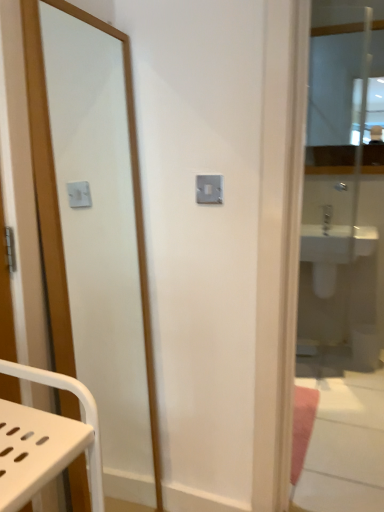
Locate an element on the screen. clear glass mirror at right, which ranks as the 2th mirror in front-to-back order is located at coordinates (343, 262).

At what (x,y) coordinates should I click in order to perform the action: click on matte wooden mirror at left, acting as the first mirror starting from the left. Please return your answer as a coordinate pair (x, y). This screenshot has height=512, width=384. Looking at the image, I should click on (104, 230).

How much space does matte wooden mirror at left, acting as the first mirror starting from the left, occupy vertically?

matte wooden mirror at left, acting as the first mirror starting from the left, is 1.64 meters in height.

You are a GUI agent. You are given a task and a screenshot of the screen. Output one action in this format:
    pyautogui.click(x=<x>, y=<y>)
    Task: Click on the white glossy sink at right
    
    Given the screenshot: What is the action you would take?
    pyautogui.click(x=336, y=243)

Which object is closer to the camera taking this photo, clear glass mirror at right, placed as the 2th mirror when sorted from back to front, or matte wooden mirror at left, which is the third mirror in back-to-front order?

matte wooden mirror at left, which is the third mirror in back-to-front order, is in front.

Between clear glass mirror at right, the second mirror from the left, and matte wooden mirror at left, which is the third mirror in back-to-front order, which one has smaller width?

Thinner between the two is clear glass mirror at right, the second mirror from the left.

Which is more to the left, clear glass mirror at right, the second mirror from the left, or matte wooden mirror at left, which is the third mirror in right-to-left order?

matte wooden mirror at left, which is the third mirror in right-to-left order.

Is clear glass mirror at right, which ranks as the 2th mirror in front-to-back order, beside matte wooden mirror at left, which is the third mirror in back-to-front order?

No, clear glass mirror at right, which ranks as the 2th mirror in front-to-back order, is not with matte wooden mirror at left, which is the third mirror in back-to-front order.

Can you tell me how much matte wooden mirror at left, which is the third mirror in back-to-front order, and clear glass mirror at right, the second mirror from the left, differ in facing direction?

69.3 degrees separate the facing orientations of matte wooden mirror at left, which is the third mirror in back-to-front order, and clear glass mirror at right, the second mirror from the left.

Considering the relative positions of matte wooden mirror at left, which is the third mirror in right-to-left order, and clear glass mirror at right, placed as the second mirror when sorted from right to left, in the image provided, is matte wooden mirror at left, which is the third mirror in right-to-left order, to the left of clear glass mirror at right, placed as the second mirror when sorted from right to left, from the viewer's perspective?

Indeed, matte wooden mirror at left, which is the third mirror in right-to-left order, is positioned on the left side of clear glass mirror at right, placed as the second mirror when sorted from right to left.

Is clear glass mirror at right, placed as the second mirror when sorted from right to left, completely or partially inside matte wooden mirror at left, which is the third mirror in right-to-left order?

No, clear glass mirror at right, placed as the second mirror when sorted from right to left, is not a part of matte wooden mirror at left, which is the third mirror in right-to-left order.

Is clear glass mirror at right, placed as the second mirror when sorted from right to left, at the back of matte wooden mirror at left, which is the third mirror in back-to-front order?

No, matte wooden mirror at left, which is the third mirror in back-to-front order, is not facing away from clear glass mirror at right, placed as the second mirror when sorted from right to left.

Would you consider white glossy sink at right to be distant from clear glass mirror at right, placed as the 2th mirror when sorted from back to front?

white glossy sink at right is near clear glass mirror at right, placed as the 2th mirror when sorted from back to front, not far away.

Identify the location of the 1st mirror in front when counting from the white glossy sink at right. The width and height of the screenshot is (384, 512). (343, 262).

Choose the correct answer: Is white glossy sink at right inside clear glass mirror at right, the second mirror from the left, or outside it?

white glossy sink at right is spatially situated outside clear glass mirror at right, the second mirror from the left.

Identify the location of sink in front of the clear glass mirror at upper right, placed as the first mirror when sorted from back to front. Image resolution: width=384 pixels, height=512 pixels. (336, 243).

Is white glossy sink at right oriented towards clear glass mirror at upper right, the first mirror in the right-to-left sequence?

→ No, white glossy sink at right is not oriented towards clear glass mirror at upper right, the first mirror in the right-to-left sequence.

Considering the relative positions of white glossy sink at right and clear glass mirror at upper right, the first mirror in the right-to-left sequence, in the image provided, is white glossy sink at right to the left or to the right of clear glass mirror at upper right, the first mirror in the right-to-left sequence,?

white glossy sink at right is positioned on clear glass mirror at upper right, the first mirror in the right-to-left sequence,'s left side.

From a real-world perspective, is white glossy sink at right on top of clear glass mirror at upper right, the first mirror in the right-to-left sequence?

No, from a real-world perspective, white glossy sink at right is not above clear glass mirror at upper right, the first mirror in the right-to-left sequence.

Can you confirm if clear glass mirror at upper right, placed as the first mirror when sorted from back to front, is smaller than clear glass mirror at right, placed as the 2th mirror when sorted from back to front?

Yes.

Is clear glass mirror at upper right, which appears as the third mirror when viewed from the left, beside clear glass mirror at right, the second mirror from the left?

No, clear glass mirror at upper right, which appears as the third mirror when viewed from the left, is not in contact with clear glass mirror at right, the second mirror from the left.

Could you measure the distance between clear glass mirror at upper right, which appears as the third mirror when viewed from the left, and clear glass mirror at right, placed as the 2th mirror when sorted from back to front?

The distance of clear glass mirror at upper right, which appears as the third mirror when viewed from the left, from clear glass mirror at right, placed as the 2th mirror when sorted from back to front, is 1.77 meters.

Considering the sizes of clear glass mirror at upper right, placed as the first mirror when sorted from back to front, and clear glass mirror at right, the second mirror from the left, in the image, is clear glass mirror at upper right, placed as the first mirror when sorted from back to front, wider or thinner than clear glass mirror at right, the second mirror from the left,?

Clearly, clear glass mirror at upper right, placed as the first mirror when sorted from back to front, has less width compared to clear glass mirror at right, the second mirror from the left.

Does clear glass mirror at right, which ranks as the 2th mirror in front-to-back order, turn towards white glossy sink at right?

Yes, clear glass mirror at right, which ranks as the 2th mirror in front-to-back order, is oriented towards white glossy sink at right.

From their relative heights in the image, would you say clear glass mirror at right, which ranks as the 2th mirror in front-to-back order, is taller or shorter than white glossy sink at right?

Considering their sizes, clear glass mirror at right, which ranks as the 2th mirror in front-to-back order, has more height than white glossy sink at right.

Which object is closer to the camera taking this photo, clear glass mirror at right, placed as the 2th mirror when sorted from back to front, or white glossy sink at right?

clear glass mirror at right, placed as the 2th mirror when sorted from back to front, is in front.

From the image's perspective, between clear glass mirror at right, placed as the second mirror when sorted from right to left, and white glossy sink at right, who is located below?

white glossy sink at right, from the image's perspective.

Considering the sizes of objects matte wooden mirror at left, acting as the first mirror starting from the left, and clear glass mirror at upper right, which is the third mirror from front to back, in the image provided, who is wider, matte wooden mirror at left, acting as the first mirror starting from the left, or clear glass mirror at upper right, which is the third mirror from front to back,?

matte wooden mirror at left, acting as the first mirror starting from the left, is wider.

Considering the sizes of matte wooden mirror at left, the 1th mirror positioned from the front, and clear glass mirror at upper right, placed as the first mirror when sorted from back to front, in the image, is matte wooden mirror at left, the 1th mirror positioned from the front, taller or shorter than clear glass mirror at upper right, placed as the first mirror when sorted from back to front,?

Considering their sizes, matte wooden mirror at left, the 1th mirror positioned from the front, has more height than clear glass mirror at upper right, placed as the first mirror when sorted from back to front.

Is matte wooden mirror at left, the 1th mirror positioned from the front, not inside clear glass mirror at upper right, placed as the first mirror when sorted from back to front?

Yes.

In the image, is matte wooden mirror at left, which is the third mirror in right-to-left order, positioned in front of or behind clear glass mirror at upper right, placed as the first mirror when sorted from back to front?

matte wooden mirror at left, which is the third mirror in right-to-left order, is positioned closer to the viewer than clear glass mirror at upper right, placed as the first mirror when sorted from back to front.

Locate an element on the screen. The image size is (384, 512). mirror that is the 1st one above the matte wooden mirror at left, which is the third mirror in back-to-front order (from a real-world perspective) is located at coordinates coord(343,262).

Locate an element on the screen. mirror that appears in front of the clear glass mirror at right, the second mirror from the left is located at coordinates (104, 230).

Based on their spatial positions, is clear glass mirror at upper right, the first mirror in the right-to-left sequence, or clear glass mirror at right, placed as the 2th mirror when sorted from back to front, further from matte wooden mirror at left, which is the third mirror in back-to-front order?

Based on the image, clear glass mirror at upper right, the first mirror in the right-to-left sequence, appears to be further to matte wooden mirror at left, which is the third mirror in back-to-front order.

When comparing their distances from white glossy sink at right, does matte wooden mirror at left, which is the third mirror in back-to-front order, or clear glass mirror at upper right, the first mirror in the right-to-left sequence, seem further?

Based on the image, clear glass mirror at upper right, the first mirror in the right-to-left sequence, appears to be further to white glossy sink at right.

Based on their spatial positions, is matte wooden mirror at left, the 1th mirror positioned from the front, or clear glass mirror at upper right, the first mirror in the right-to-left sequence, further from clear glass mirror at right, the second mirror from the left?

Based on the image, clear glass mirror at upper right, the first mirror in the right-to-left sequence, appears to be further to clear glass mirror at right, the second mirror from the left.

When comparing their distances from clear glass mirror at upper right, which is the third mirror from front to back, does white glossy sink at right or matte wooden mirror at left, the 1th mirror positioned from the front, seem further?

matte wooden mirror at left, the 1th mirror positioned from the front, lies further to clear glass mirror at upper right, which is the third mirror from front to back, than the other object.

Considering their positions, is matte wooden mirror at left, which is the third mirror in back-to-front order, positioned further to clear glass mirror at upper right, which appears as the third mirror when viewed from the left, than white glossy sink at right?

Based on the image, matte wooden mirror at left, which is the third mirror in back-to-front order, appears to be further to clear glass mirror at upper right, which appears as the third mirror when viewed from the left.

Estimate the real-world distances between objects in this image. Which object is further from clear glass mirror at upper right, which appears as the third mirror when viewed from the left, clear glass mirror at right, placed as the second mirror when sorted from right to left, or matte wooden mirror at left, acting as the first mirror starting from the left?

Based on the image, matte wooden mirror at left, acting as the first mirror starting from the left, appears to be further to clear glass mirror at upper right, which appears as the third mirror when viewed from the left.

Considering their positions, is clear glass mirror at right, placed as the 2th mirror when sorted from back to front, positioned closer to white glossy sink at right than matte wooden mirror at left, which is the third mirror in right-to-left order?

Among the two, clear glass mirror at right, placed as the 2th mirror when sorted from back to front, is located nearer to white glossy sink at right.

Consider the image. When comparing their distances from matte wooden mirror at left, the 1th mirror positioned from the front, does clear glass mirror at right, placed as the 2th mirror when sorted from back to front, or white glossy sink at right seem further?

Based on the image, white glossy sink at right appears to be further to matte wooden mirror at left, the 1th mirror positioned from the front.

Image resolution: width=384 pixels, height=512 pixels. In order to click on mirror between matte wooden mirror at left, acting as the first mirror starting from the left, and white glossy sink at right in the front-back direction in this screenshot , I will do `click(343, 262)`.

Where is `sink between matte wooden mirror at left, which is the third mirror in back-to-front order, and clear glass mirror at upper right, which appears as the third mirror when viewed from the left, from front to back`? Image resolution: width=384 pixels, height=512 pixels. sink between matte wooden mirror at left, which is the third mirror in back-to-front order, and clear glass mirror at upper right, which appears as the third mirror when viewed from the left, from front to back is located at coordinates (336, 243).

This screenshot has height=512, width=384. I want to click on mirror between matte wooden mirror at left, the 1th mirror positioned from the front, and clear glass mirror at upper right, which is the third mirror from front to back, from front to back, so click(343, 262).

Where is `mirror between clear glass mirror at upper right, which appears as the third mirror when viewed from the left, and white glossy sink at right from top to bottom`? This screenshot has height=512, width=384. mirror between clear glass mirror at upper right, which appears as the third mirror when viewed from the left, and white glossy sink at right from top to bottom is located at coordinates (343, 262).